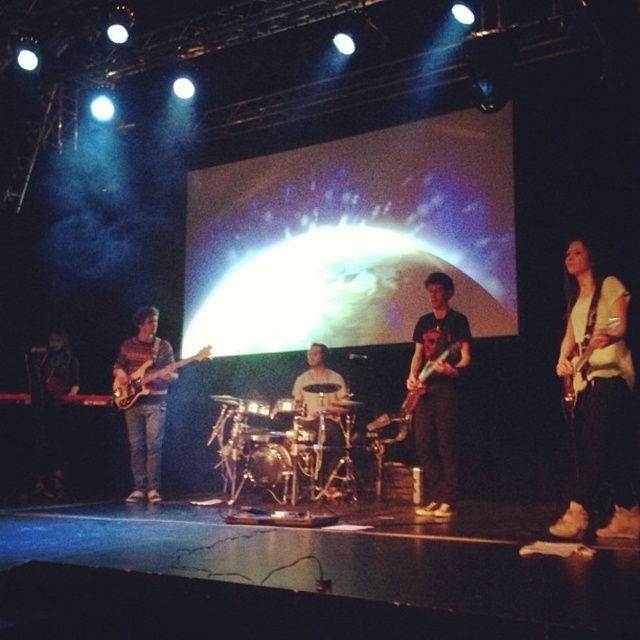
You are a stagehand setting up microphones for the band. You have two matte black guitars on stage. The matte black guitar at center and the matte black electric guitar at left. Which guitar is thinner?

The matte black guitar at center is thinner than the matte black electric guitar at left.

You are a photographer adjusting your camera settings to capture the stage. You notice two points marked on your viewfinder at coordinates point (442, 468) and point (116, 406). Which point should you focus on to ensure it appears sharper in the final photo?

You should focus on point (442, 468) because it is closer to the camera than point (116, 406), making it appear sharper in the photo.

You are a stagehand who needs to place a new spotlight on the stage. The spotlight can only be placed at point (436, 392). What object is located at that point?

The matte black guitar at center is located at point (436, 392).